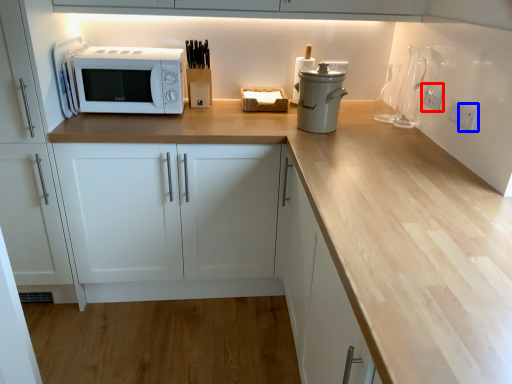
Question: Which of the following is the closest to the observer, electric outlet (highlighted by a red box) or electric outlet (highlighted by a blue box)?

Choices:
 (A) electric outlet
 (B) electric outlet

Answer: (B)